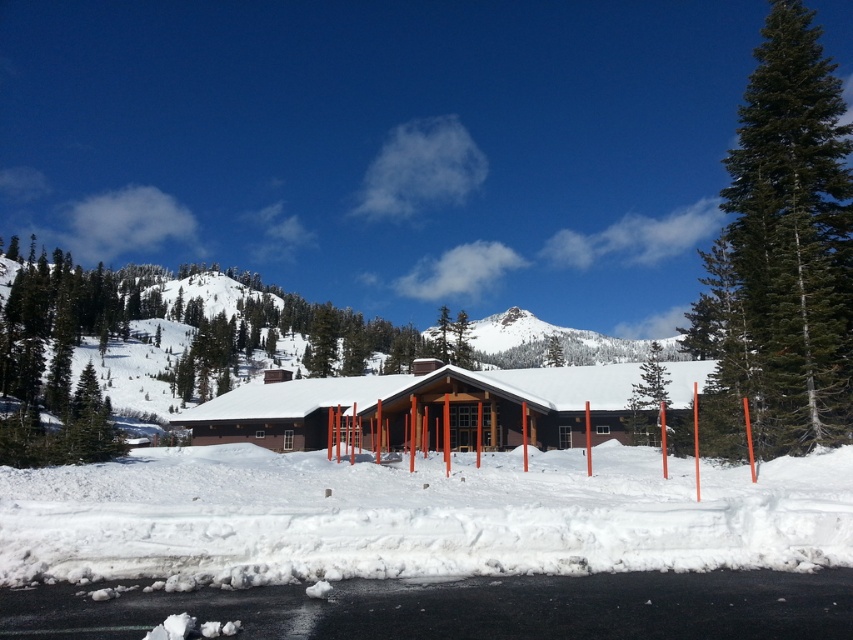
Who is lower down, green textured pine tree at right or brown wooden cabin at center?

brown wooden cabin at center is lower down.

Does green textured pine tree at right appear on the right side of brown wooden cabin at center?

Indeed, green textured pine tree at right is positioned on the right side of brown wooden cabin at center.

The width and height of the screenshot is (853, 640). What are the coordinates of `green textured pine tree at right` in the screenshot? It's located at (782, 253).

Is green textured pine tree at right behind green textured pine tree at center?

No, it is not.

Does green textured pine tree at right have a greater height compared to green textured pine tree at center?

Yes, green textured pine tree at right is taller than green textured pine tree at center.

Where is `green textured pine tree at right`? Image resolution: width=853 pixels, height=640 pixels. green textured pine tree at right is located at coordinates (782, 253).

From the picture: Who is more forward, [592,369] or [633,396]?

Point [633,396] is in front.

The width and height of the screenshot is (853, 640). Find the location of `brown wooden cabin at center`. brown wooden cabin at center is located at coordinates (426, 406).